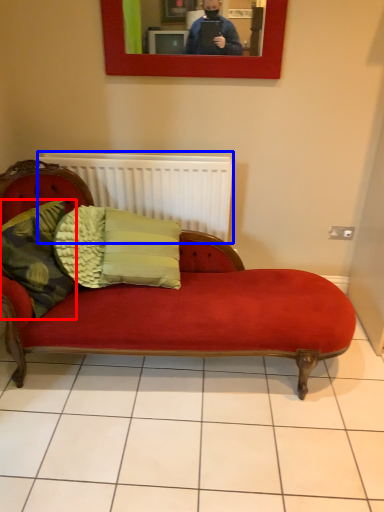
Question: Which of the following is the closest to the observer, pillow (highlighted by a red box) or radiator (highlighted by a blue box)?

Choices:
 (A) pillow
 (B) radiator

Answer: (A)